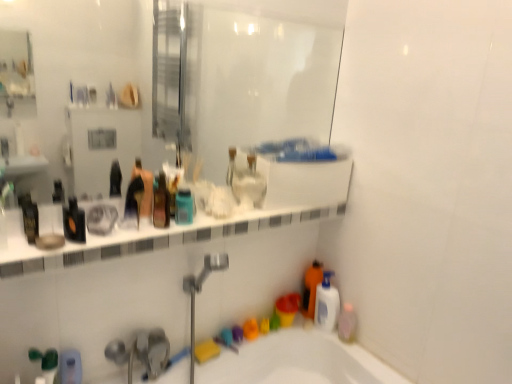
Question: Is translucent plastic soap dispenser at lower left, the 3th toiletry viewed from the top, oriented towards matte black bottle at center, positioned as the second toiletry in top-to-bottom order?

Choices:
 (A) no
 (B) yes

Answer: (A)

Question: Can you confirm if translucent plastic soap dispenser at lower left, which appears as the third toiletry when viewed from the right, is taller than matte black bottle at center, positioned as the second toiletry in top-to-bottom order?

Choices:
 (A) no
 (B) yes

Answer: (B)

Question: Is matte black bottle at center, positioned as the 2th toiletry in bottom-to-top order, completely or partially inside translucent plastic soap dispenser at lower left, which appears as the third toiletry when viewed from the right?

Choices:
 (A) yes
 (B) no

Answer: (B)

Question: Can you confirm if translucent plastic soap dispenser at lower left, the 3th toiletry viewed from the top, is positioned to the right of matte black bottle at center, positioned as the 2th toiletry in bottom-to-top order?

Choices:
 (A) yes
 (B) no

Answer: (B)

Question: Considering the relative sizes of translucent plastic soap dispenser at lower left, which appears as the third toiletry when viewed from the right, and matte black bottle at center, which appears as the 2th toiletry when viewed from the left, in the image provided, is translucent plastic soap dispenser at lower left, which appears as the third toiletry when viewed from the right, smaller than matte black bottle at center, which appears as the 2th toiletry when viewed from the left,?

Choices:
 (A) no
 (B) yes

Answer: (B)

Question: Is translucent plastic soap dispenser at lower left, the first toiletry in the bottom-to-top sequence, placed right next to matte black bottle at center, positioned as the second toiletry in top-to-bottom order?

Choices:
 (A) no
 (B) yes

Answer: (A)

Question: Is translucent plastic bottle at lower right outside black glossy bottle at left, which is counted as the first mouthwash, starting from the front?

Choices:
 (A) yes
 (B) no

Answer: (A)

Question: Does translucent plastic bottle at lower right have a greater height compared to black glossy bottle at left, the 5th mouthwash positioned from the back?

Choices:
 (A) no
 (B) yes

Answer: (B)

Question: From a real-world perspective, is translucent plastic bottle at lower right located higher than black glossy bottle at left, the 1th mouthwash viewed from the left?

Choices:
 (A) no
 (B) yes

Answer: (A)

Question: Could you tell me if translucent plastic bottle at lower right is facing black glossy bottle at left, which is counted as the first mouthwash, starting from the front?

Choices:
 (A) no
 (B) yes

Answer: (A)

Question: From the image's perspective, is translucent plastic bottle at lower right located beneath black glossy bottle at left, the 1th mouthwash viewed from the left?

Choices:
 (A) yes
 (B) no

Answer: (A)

Question: Could black glossy bottle at left, the 1th mouthwash viewed from the left, be considered to be inside translucent plastic bottle at lower right?

Choices:
 (A) no
 (B) yes

Answer: (A)

Question: Does pink translucent bottle at lower right, which is the 1th mouthwash in right-to-left order, have a larger size compared to translucent plastic mouthwash at center, which appears as the 2th mouthwash when viewed from the front?

Choices:
 (A) yes
 (B) no

Answer: (A)